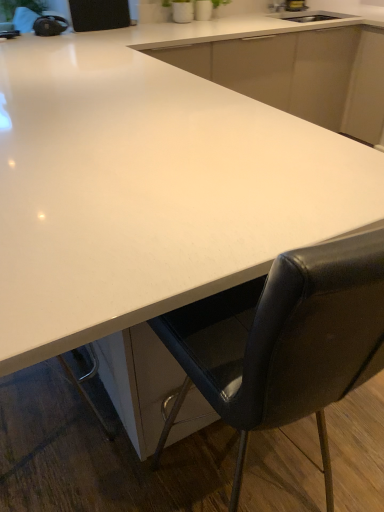
At what (x,y) coordinates should I click in order to perform the action: click on black leather chair at lower right. Please return your answer as a coordinate pair (x, y). Looking at the image, I should click on (284, 340).

From a real-world perspective, is white glossy countertop at center located higher than black leather chair at lower right?

Yes, from a real-world perspective, white glossy countertop at center is above black leather chair at lower right.

Are white glossy countertop at center and black leather chair at lower right making contact?

white glossy countertop at center and black leather chair at lower right are clearly separated.

Is white glossy countertop at center to the left or to the right of black leather chair at lower right in the image?

Clearly, white glossy countertop at center is on the right of black leather chair at lower right in the image.

From the image's perspective, is white glossy countertop at center located beneath white glossy countertop at center?

Correct, white glossy countertop at center appears lower than white glossy countertop at center in the image.

How many degrees apart are the facing directions of white glossy countertop at center and white glossy countertop at center?

0.00109 degrees separate the facing orientations of white glossy countertop at center and white glossy countertop at center.

Measure the distance from white glossy countertop at center to white glossy countertop at center.

4.16 feet.

Considering the sizes of white glossy countertop at center and white glossy countertop at center in the image, is white glossy countertop at center taller or shorter than white glossy countertop at center?

In the image, white glossy countertop at center appears to be taller than white glossy countertop at center.

From the image's perspective, is black leather chair at lower right under white glossy countertop at center?

Yes, from the image's perspective, black leather chair at lower right is below white glossy countertop at center.

Is black leather chair at lower right situated inside white glossy countertop at center or outside?

black leather chair at lower right lies within the bounds of white glossy countertop at center.

Is black leather chair at lower right beside white glossy countertop at center?

No, black leather chair at lower right is not next to white glossy countertop at center.

Can you confirm if black leather chair at lower right is taller than white glossy countertop at center?

Yes.

Is white glossy countertop at center turned away from white glossy countertop at center?

Yes, white glossy countertop at center is at the back of white glossy countertop at center.

Between white glossy countertop at center and white glossy countertop at center, which one is positioned in front?

white glossy countertop at center is more forward.

From the image's perspective, between white glossy countertop at center and white glossy countertop at center, who is located below?

white glossy countertop at center appears lower in the image.

Considering the positions of point (290, 91) and point (209, 135), is point (290, 91) closer or farther from the camera than point (209, 135)?

Point (290, 91).

Does white glossy countertop at center appear on the right side of black leather chair at lower right?

Yes.

This screenshot has height=512, width=384. I want to click on chair below the white glossy countertop at center (from the image's perspective), so click(x=284, y=340).

Is white glossy countertop at center not within black leather chair at lower right?

That's correct, white glossy countertop at center is outside of black leather chair at lower right.

Considering the points (17, 59) and (249, 330), which point is in front, point (17, 59) or point (249, 330)?

The point (249, 330) is more forward.

Which is further, (162, 449) or (167, 60)?

The point (167, 60) is behind.

Who is smaller, black leather chair at lower right or white glossy countertop at center?

With smaller size is black leather chair at lower right.

In terms of height, does black leather chair at lower right look taller or shorter compared to white glossy countertop at center?

black leather chair at lower right is taller than white glossy countertop at center.

Which is more to the right, black leather chair at lower right or white glossy countertop at center?

white glossy countertop at center is more to the right.

The height and width of the screenshot is (512, 384). In order to click on cabinetry above the black leather chair at lower right (from a real-world perspective) in this screenshot , I will do `click(298, 73)`.

At what (x,y) coordinates should I click in order to perform the action: click on countertop located below the white glossy countertop at center (from the image's perspective). Please return your answer as a coordinate pair (x, y). The image size is (384, 512). Looking at the image, I should click on (150, 185).

Estimate the real-world distances between objects in this image. Which object is closer to black leather chair at lower right, white glossy countertop at center or white glossy countertop at center?

white glossy countertop at center is positioned closer to the anchor black leather chair at lower right.

When comparing their distances from black leather chair at lower right, does white glossy countertop at center or white glossy countertop at center seem further?

The object further to black leather chair at lower right is white glossy countertop at center.

Looking at the image, which one is located further to white glossy countertop at center, black leather chair at lower right or white glossy countertop at center?

The object further to white glossy countertop at center is black leather chair at lower right.

From the image, which object appears to be farther from white glossy countertop at center, black leather chair at lower right or white glossy countertop at center?

Based on the image, white glossy countertop at center appears to be further to white glossy countertop at center.

Looking at this image, considering their positions, is white glossy countertop at center positioned further to white glossy countertop at center than black leather chair at lower right?

white glossy countertop at center.

Considering their positions, is white glossy countertop at center positioned further to white glossy countertop at center than black leather chair at lower right?

Among the two, black leather chair at lower right is located further to white glossy countertop at center.

Locate an element on the screen. Image resolution: width=384 pixels, height=512 pixels. countertop between black leather chair at lower right and white glossy countertop at center from front to back is located at coordinates (150, 185).